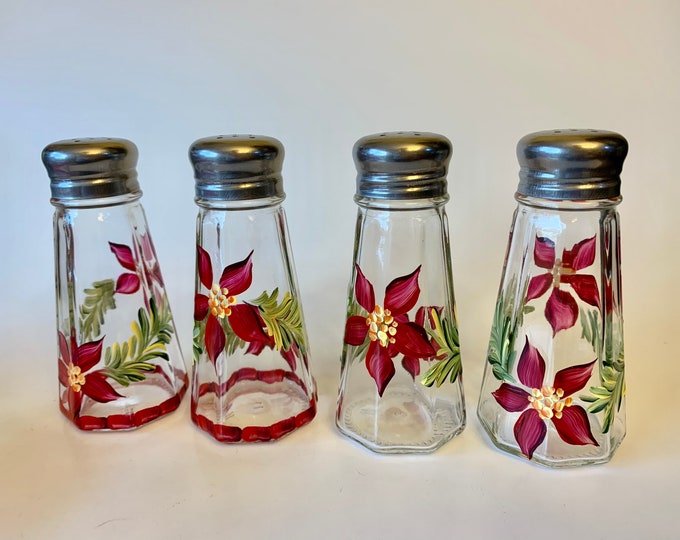
Image resolution: width=680 pixels, height=540 pixels. I want to click on light, so click(413, 148).